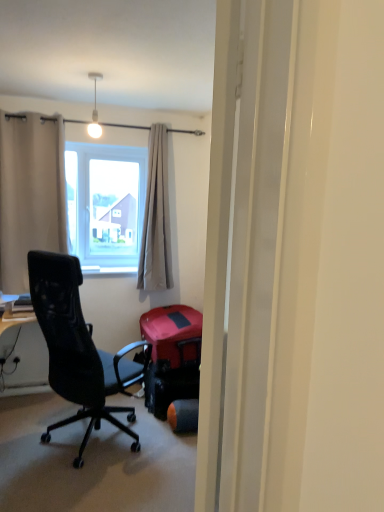
Question: Can you confirm if white glossy light bulb at upper center is bigger than beige fabric curtain at left, arranged as the 1th curtain when viewed from the left?

Choices:
 (A) no
 (B) yes

Answer: (A)

Question: Is the surface of white glossy light bulb at upper center in direct contact with beige fabric curtain at left, arranged as the 1th curtain when viewed from the left?

Choices:
 (A) no
 (B) yes

Answer: (A)

Question: Considering the relative sizes of white glossy light bulb at upper center and beige fabric curtain at left, arranged as the 1th curtain when viewed from the left, in the image provided, is white glossy light bulb at upper center wider than beige fabric curtain at left, arranged as the 1th curtain when viewed from the left,?

Choices:
 (A) yes
 (B) no

Answer: (B)

Question: Is white glossy light bulb at upper center further to camera compared to beige fabric curtain at left, placed as the second curtain when sorted from right to left?

Choices:
 (A) no
 (B) yes

Answer: (A)

Question: From the image's perspective, would you say white glossy light bulb at upper center is positioned over beige fabric curtain at left, placed as the second curtain when sorted from right to left?

Choices:
 (A) no
 (B) yes

Answer: (B)

Question: Would you say white glossy light bulb at upper center is outside beige fabric curtain at left, placed as the second curtain when sorted from right to left?

Choices:
 (A) yes
 (B) no

Answer: (A)

Question: Is the surface of light beige fabric curtain at center, the second curtain positioned from the left, in direct contact with beige fabric curtain at left, placed as the second curtain when sorted from right to left?

Choices:
 (A) no
 (B) yes

Answer: (A)

Question: Is light beige fabric curtain at center, the second curtain positioned from the left, oriented towards beige fabric curtain at left, arranged as the 1th curtain when viewed from the left?

Choices:
 (A) yes
 (B) no

Answer: (B)

Question: Is the depth of light beige fabric curtain at center, which appears as the 1th curtain when viewed from the right, greater than that of beige fabric curtain at left, arranged as the 1th curtain when viewed from the left?

Choices:
 (A) no
 (B) yes

Answer: (B)

Question: Can you confirm if light beige fabric curtain at center, which appears as the 1th curtain when viewed from the right, is bigger than beige fabric curtain at left, arranged as the 1th curtain when viewed from the left?

Choices:
 (A) no
 (B) yes

Answer: (A)

Question: Is light beige fabric curtain at center, the second curtain positioned from the left, positioned before beige fabric curtain at left, placed as the second curtain when sorted from right to left?

Choices:
 (A) yes
 (B) no

Answer: (B)

Question: Would you say light beige fabric curtain at center, the second curtain positioned from the left, is a long distance from beige fabric curtain at left, placed as the second curtain when sorted from right to left?

Choices:
 (A) no
 (B) yes

Answer: (A)

Question: Is beige fabric curtain at left, arranged as the 1th curtain when viewed from the left, wider than white glossy light bulb at upper center?

Choices:
 (A) yes
 (B) no

Answer: (A)